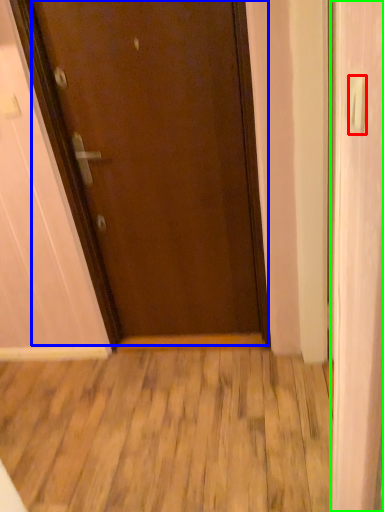
Question: Considering the real-world distances, which object is farthest from door handle (highlighted by a red box)? door (highlighted by a blue box) or screen door (highlighted by a green box)?

Choices:
 (A) door
 (B) screen door

Answer: (A)